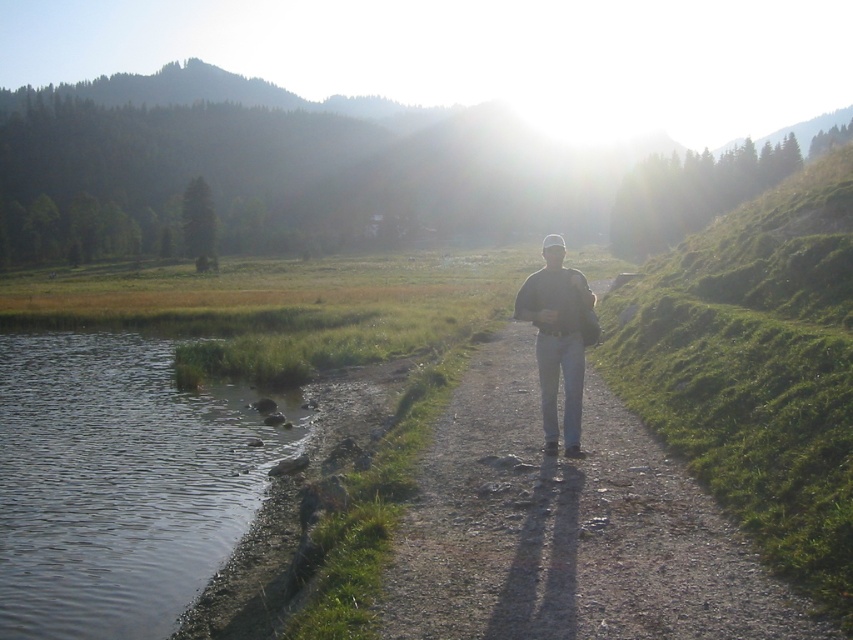
Question: Among these objects, which one is farthest from the camera?

Choices:
 (A) dirt/gravel path at center
 (B) clear water at lower left

Answer: (B)

Question: Can you confirm if green grassy hillside at center is positioned above clear water at lower left?

Choices:
 (A) yes
 (B) no

Answer: (A)

Question: Based on their relative distances, which object is nearer to the green grassy hillside at center?

Choices:
 (A) clear water at lower left
 (B) gray cotton shirt at center

Answer: (A)

Question: In this image, where is green grassy hillside at center located relative to dirt/gravel path at center?

Choices:
 (A) above
 (B) below

Answer: (A)

Question: Can you confirm if dirt/gravel path at center is positioned below clear water at lower left?

Choices:
 (A) yes
 (B) no

Answer: (B)

Question: Which object is closer to the camera taking this photo?

Choices:
 (A) gray cotton shirt at center
 (B) clear water at lower left
 (C) dirt/gravel path at center

Answer: (C)